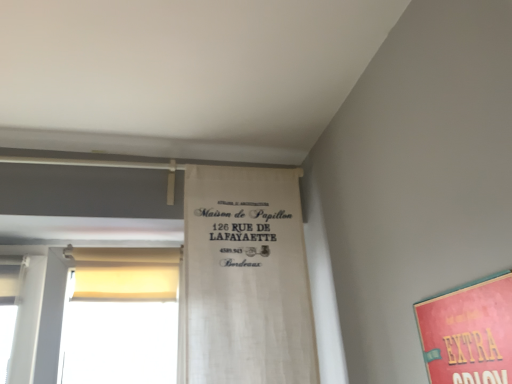
Describe the element at coordinates (246, 278) in the screenshot. I see `white fabric banner at center` at that location.

This screenshot has height=384, width=512. I want to click on white fabric banner at center, so click(246, 278).

The height and width of the screenshot is (384, 512). Describe the element at coordinates (469, 333) in the screenshot. I see `matte pink poster at lower right` at that location.

You are a GUI agent. You are given a task and a screenshot of the screen. Output one action in this format:
    pyautogui.click(x=<x>, y=<y>)
    Task: Click on the matte pink poster at lower right
    This screenshot has width=512, height=384.
    Given the screenshot: What is the action you would take?
    pyautogui.click(x=469, y=333)

The width and height of the screenshot is (512, 384). I want to click on white fabric banner at center, so pyautogui.click(x=246, y=278).

Which is more to the left, white fabric banner at center or matte pink poster at lower right?

white fabric banner at center is more to the left.

Does white fabric banner at center come behind matte pink poster at lower right?

Yes, it is.

Is point (298, 289) closer to camera compared to point (509, 350)?

No, it is not.

In the scene shown: From the image's perspective, is white fabric banner at center located above matte pink poster at lower right?

Yes.

From a real-world perspective, is white fabric banner at center physically above matte pink poster at lower right?

Yes, from a real-world perspective, white fabric banner at center is above matte pink poster at lower right.

Is white fabric banner at center wider than matte pink poster at lower right?

Indeed, white fabric banner at center has a greater width compared to matte pink poster at lower right.

Can you confirm if white fabric banner at center is shorter than matte pink poster at lower right?

In fact, white fabric banner at center may be taller than matte pink poster at lower right.

Based on their sizes in the image, would you say white fabric banner at center is bigger or smaller than matte pink poster at lower right?

Considering their sizes, white fabric banner at center takes up more space than matte pink poster at lower right.

Would you say white fabric banner at center is inside or outside matte pink poster at lower right?

The correct answer is: outside.

Are white fabric banner at center and matte pink poster at lower right located far from each other?

No, white fabric banner at center is not far from matte pink poster at lower right.

Is white fabric banner at center aimed at matte pink poster at lower right?

Yes, white fabric banner at center is aimed at matte pink poster at lower right.

How different are the orientations of white fabric banner at center and matte pink poster at lower right in degrees?

They differ by 90.3 degrees in their facing directions.

From the picture: How far apart are white fabric banner at center and matte pink poster at lower right?

white fabric banner at center and matte pink poster at lower right are 26.35 inches apart from each other.

Identify the location of bulletin board on the left of matte pink poster at lower right. Image resolution: width=512 pixels, height=384 pixels. (246, 278).

Considering the relative positions of matte pink poster at lower right and white fabric banner at center in the image provided, is matte pink poster at lower right to the right of white fabric banner at center from the viewer's perspective?

Indeed, matte pink poster at lower right is positioned on the right side of white fabric banner at center.

Relative to white fabric banner at center, is matte pink poster at lower right in front or behind?

Clearly, matte pink poster at lower right is in front of white fabric banner at center.

Is point (483, 328) behind point (233, 326)?

That is False.

From the image's perspective, which object appears higher, matte pink poster at lower right or white fabric banner at center?

white fabric banner at center.

Looking at this image, from a real-world perspective, is matte pink poster at lower right located higher than white fabric banner at center?

Incorrect, from a real-world perspective, matte pink poster at lower right is lower than white fabric banner at center.

Which of these two, matte pink poster at lower right or white fabric banner at center, is thinner?

With smaller width is matte pink poster at lower right.

Can you confirm if matte pink poster at lower right is taller than white fabric banner at center?

No.

Looking at this image, which of these two, matte pink poster at lower right or white fabric banner at center, is smaller?

With smaller size is matte pink poster at lower right.

Does matte pink poster at lower right contain white fabric banner at center?

That's incorrect, white fabric banner at center is not inside matte pink poster at lower right.

Is matte pink poster at lower right in contact with white fabric banner at center?

No, matte pink poster at lower right is not beside white fabric banner at center.

Is matte pink poster at lower right looking in the opposite direction of white fabric banner at center?

matte pink poster at lower right is not turned away from white fabric banner at center.

How many degrees apart are the facing directions of matte pink poster at lower right and white fabric banner at center?

The facing directions of matte pink poster at lower right and white fabric banner at center are 90.3 degrees apart.

Locate an element on the screen. This screenshot has height=384, width=512. bulletin board located behind the matte pink poster at lower right is located at coordinates (246, 278).

The image size is (512, 384). Identify the location of poster below the white fabric banner at center (from the image's perspective). (469, 333).

Find the location of a particular element. poster in front of the white fabric banner at center is located at coordinates (469, 333).